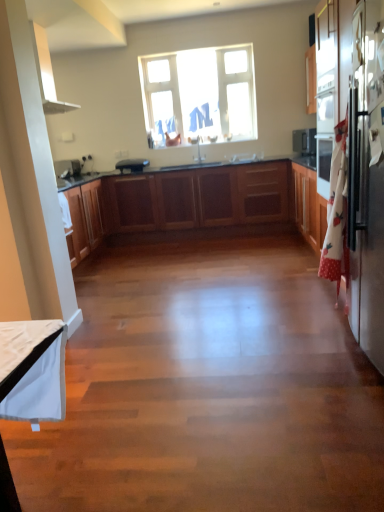
Measure the distance between point (45,97) and camera.

Point (45,97) is 9.14 feet away from camera.

You are a GUI agent. You are given a task and a screenshot of the screen. Output one action in this format:
    pyautogui.click(x=<x>, y=<y>)
    Task: Click on the clear glass window at upper center
    
    Given the screenshot: What is the action you would take?
    pyautogui.click(x=199, y=95)

At what (x,y) coordinates should I click in order to perform the action: click on sleek stainless steel refrigerator at right. Please return your answer as a coordinate pair (x, y). Looking at the image, I should click on pos(368,183).

Where is `wooden cabinets at center`? The image size is (384, 512). wooden cabinets at center is located at coordinates tap(194, 202).

Which of these two, wooden cabinets at center or white glossy sink at center, stands taller?

wooden cabinets at center is taller.

Is wooden cabinets at center facing away from white glossy sink at center?

No.

Based on the photo, is wooden cabinets at center spatially inside white glossy sink at center, or outside of it?

wooden cabinets at center is spatially situated outside white glossy sink at center.

Would you say clear glass window at upper center is part of white matte exhaust hood at upper left's contents?

No, clear glass window at upper center is not surrounded by white matte exhaust hood at upper left.

How different are the orientations of white matte exhaust hood at upper left and clear glass window at upper center in degrees?

There is a 91.6-degree angle between the facing directions of white matte exhaust hood at upper left and clear glass window at upper center.

Does white matte exhaust hood at upper left touch clear glass window at upper center?

white matte exhaust hood at upper left and clear glass window at upper center are clearly separated.

From a real-world perspective, which object stands above the other?

white matte exhaust hood at upper left.

Is point (126, 165) farther from camera compared to point (378, 25)?

Yes, it is.

From a real-world perspective, which is physically above, black matte toaster at center or sleek stainless steel refrigerator at right?

From a 3D spatial view, black matte toaster at center is above.

Is black matte toaster at center closer to the viewer compared to sleek stainless steel refrigerator at right?

No, it is behind sleek stainless steel refrigerator at right.

Looking at this image, does clear glass window at upper center touch white glossy sink at center?

No, clear glass window at upper center is not next to white glossy sink at center.

Who is bigger, clear glass window at upper center or white glossy sink at center?

clear glass window at upper center.

What's the angular difference between clear glass window at upper center and white glossy sink at center's facing directions?

They differ by 0.0113 degrees in their facing directions.

Find the location of a particular element. The width and height of the screenshot is (384, 512). sink beneath the clear glass window at upper center (from a real-world perspective) is located at coordinates (245, 158).

Between sleek stainless steel refrigerator at right and white matte exhaust hood at upper left, which one has larger size?

With larger size is sleek stainless steel refrigerator at right.

Is sleek stainless steel refrigerator at right positioned with its back to white matte exhaust hood at upper left?

That's not correct — sleek stainless steel refrigerator at right is not looking away from white matte exhaust hood at upper left.

Considering the relative sizes of sleek stainless steel refrigerator at right and white matte exhaust hood at upper left in the image provided, is sleek stainless steel refrigerator at right taller than white matte exhaust hood at upper left?

Yes, sleek stainless steel refrigerator at right is taller than white matte exhaust hood at upper left.

Is point (377, 55) closer or farther from the camera than point (64, 109)?

Point (377, 55) appears to be closer to the viewer than point (64, 109).

Is white glossy sink at center bigger than sleek stainless steel refrigerator at right?

Actually, white glossy sink at center might be smaller than sleek stainless steel refrigerator at right.

From the picture: Between white glossy sink at center and sleek stainless steel refrigerator at right, which one is positioned in front?

sleek stainless steel refrigerator at right is more forward.

From the picture: Is white glossy sink at center far from sleek stainless steel refrigerator at right?

Yes, white glossy sink at center and sleek stainless steel refrigerator at right are quite far apart.

Considering the positions of objects white glossy sink at center and sleek stainless steel refrigerator at right in the image provided, who is more to the left, white glossy sink at center or sleek stainless steel refrigerator at right?

Positioned to the left is white glossy sink at center.

Does point (242, 161) lie behind point (149, 71)?

That is False.

Are white glossy sink at center and clear glass window at upper center making contact?

No.

From the picture: Considering the relative sizes of white glossy sink at center and clear glass window at upper center in the image provided, is white glossy sink at center smaller than clear glass window at upper center?

Yes.

Is white glossy sink at center closer to camera compared to clear glass window at upper center?

Yes.

The height and width of the screenshot is (512, 384). In order to click on sink on the right of wooden cabinets at center in this screenshot , I will do `click(245, 158)`.

Identify the location of exhaust hood lying in front of the clear glass window at upper center. (46, 73).

In the scene shown: From the image, which object appears to be nearer to sleek stainless steel refrigerator at right, black matte toaster at center or clear glass window at upper center?

Among the two, clear glass window at upper center is located nearer to sleek stainless steel refrigerator at right.

Estimate the real-world distances between objects in this image. Which object is further from wooden cabinets at center, clear glass window at upper center or white glossy sink at center?

white glossy sink at center is further to wooden cabinets at center.

Considering their positions, is clear glass window at upper center positioned closer to sleek stainless steel refrigerator at right than white glossy sink at center?

white glossy sink at center is positioned closer to the anchor sleek stainless steel refrigerator at right.

From the image, which object appears to be nearer to sleek stainless steel refrigerator at right, white glossy sink at center or white matte exhaust hood at upper left?

white matte exhaust hood at upper left is closer to sleek stainless steel refrigerator at right.

Estimate the real-world distances between objects in this image. Which object is closer to clear glass window at upper center, wooden cabinets at center or white matte exhaust hood at upper left?

wooden cabinets at center is closer to clear glass window at upper center.

From the image, which object appears to be nearer to black matte toaster at center, white glossy sink at center or wooden cabinets at center?

Among the two, wooden cabinets at center is located nearer to black matte toaster at center.

Considering their positions, is white glossy sink at center positioned closer to wooden cabinets at center than sleek stainless steel refrigerator at right?

Based on the image, white glossy sink at center appears to be nearer to wooden cabinets at center.

Which object lies further to the anchor point black matte toaster at center, wooden cabinets at center or white glossy sink at center?

white glossy sink at center is positioned further to the anchor black matte toaster at center.

Where is `sink positioned between sleek stainless steel refrigerator at right and clear glass window at upper center from near to far`? This screenshot has height=512, width=384. sink positioned between sleek stainless steel refrigerator at right and clear glass window at upper center from near to far is located at coordinates (245, 158).

The width and height of the screenshot is (384, 512). Identify the location of window between white matte exhaust hood at upper left and white glossy sink at center from left to right. (199, 95).

Find the location of `exhaust hood located between sleek stainless steel refrigerator at right and clear glass window at upper center in the depth direction`. exhaust hood located between sleek stainless steel refrigerator at right and clear glass window at upper center in the depth direction is located at coordinates (46, 73).

Locate an element on the screen. The image size is (384, 512). appliance between sleek stainless steel refrigerator at right and clear glass window at upper center in the front-back direction is located at coordinates (132, 164).